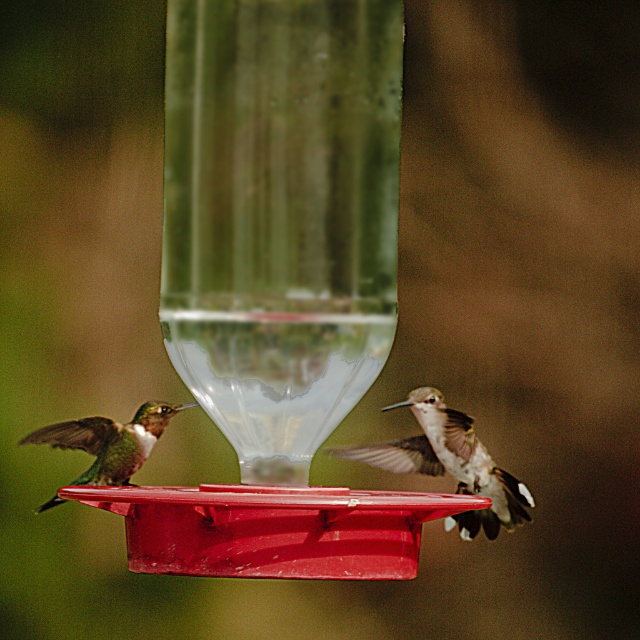
Who is positioned more to the left, matte plastic bird feeder at center or white iridescent feathers at right?

matte plastic bird feeder at center is more to the left.

Can you confirm if matte plastic bird feeder at center is wider than white iridescent feathers at right?

Yes.

The image size is (640, 640). What are the coordinates of `matte plastic bird feeder at center` in the screenshot? It's located at (278, 284).

Who is positioned more to the right, matte plastic bird feeder at center or shiny green hummingbird at left?

Positioned to the right is matte plastic bird feeder at center.

Does matte plastic bird feeder at center come in front of shiny green hummingbird at left?

Yes, matte plastic bird feeder at center is in front of shiny green hummingbird at left.

Find the location of `matte plastic bird feeder at center`. matte plastic bird feeder at center is located at coordinates (278, 284).

How much distance is there between white iridescent feathers at right and shiny green hummingbird at left?

They are 18.75 inches apart.

Can you confirm if white iridescent feathers at right is shorter than shiny green hummingbird at left?

No, white iridescent feathers at right is not shorter than shiny green hummingbird at left.

Locate an element on the screen. The image size is (640, 640). white iridescent feathers at right is located at coordinates pyautogui.click(x=451, y=464).

Find the location of a particular element. This screenshot has height=640, width=640. white iridescent feathers at right is located at coordinates pyautogui.click(x=451, y=464).